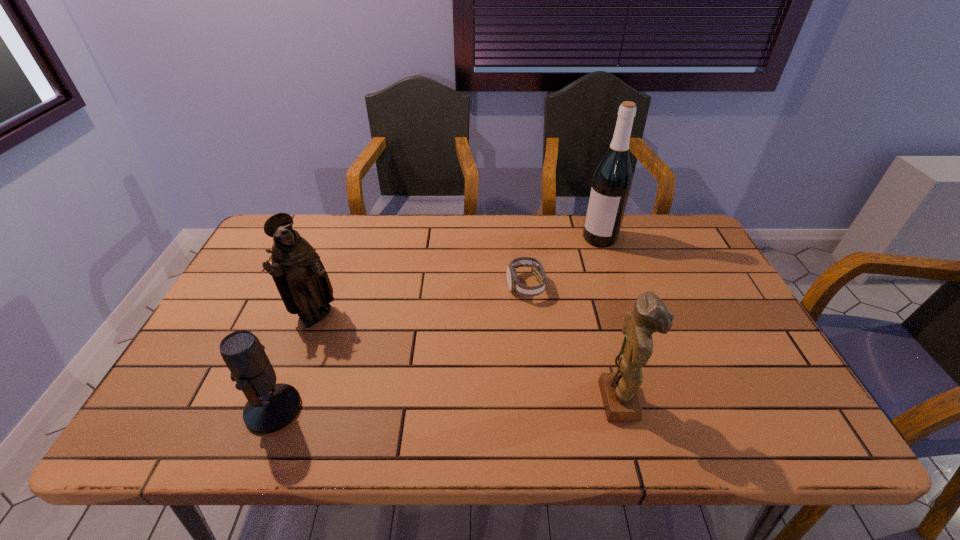
Where is `microphone`? microphone is located at coordinates (270, 407).

Locate an element on the screen. The image size is (960, 540). the nearer figurine is located at coordinates (619, 394).

What are the coordinates of `the third object from left to right` in the screenshot? It's located at (514, 285).

Locate an element on the screen. the shortest object is located at coordinates (514, 285).

What are the coordinates of `the farther figurine` in the screenshot? It's located at (298, 273).

This screenshot has width=960, height=540. Identify the location of the left figurine. (298, 273).

The image size is (960, 540). Identify the location of wine bottle. (612, 180).

Identify the location of the farthest object. Image resolution: width=960 pixels, height=540 pixels. (612, 180).

I want to click on free space located 0.290m on the front-facing side of the right figurine, so click(771, 401).

The width and height of the screenshot is (960, 540). Identify the location of free spot located on the face of the fourth nearest object. (494, 334).